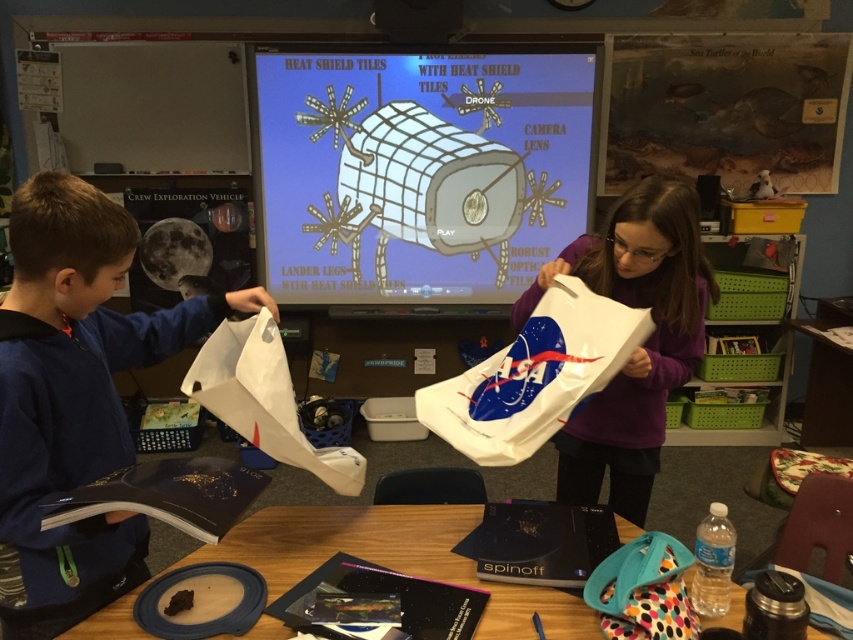
Can you confirm if white glossy screen at upper center is positioned to the right of blue fabric book at left?

Correct, you'll find white glossy screen at upper center to the right of blue fabric book at left.

This screenshot has height=640, width=853. What do you see at coordinates (419, 172) in the screenshot?
I see `white glossy screen at upper center` at bounding box center [419, 172].

Where is `white glossy screen at upper center`? white glossy screen at upper center is located at coordinates (419, 172).

Measure the distance between white fabric shirt at center and camera.

They are 4.67 feet apart.

Does white fabric shirt at center appear over wooden table at lower center?

Correct, white fabric shirt at center is located above wooden table at lower center.

Is point (581, 266) in front of point (396, 563)?

No, (581, 266) is behind (396, 563).

This screenshot has width=853, height=640. Identify the location of white fabric shirt at center. (640, 346).

Does point (48, 602) lie in front of point (444, 561)?

Yes, it is.

Does blue fabric book at left come behind wooden table at lower center?

No, blue fabric book at left is in front of wooden table at lower center.

Is point (86, 524) positioned behind point (422, 544)?

No, (86, 524) is in front of (422, 544).

Find the location of a particular element. The width and height of the screenshot is (853, 640). blue fabric book at left is located at coordinates (74, 397).